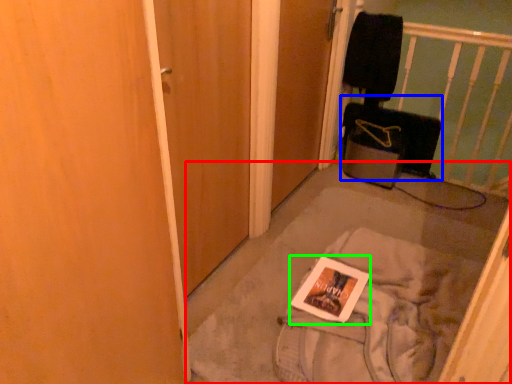
Question: Considering the real-world distances, which object is farthest from concrete (highlighted by a red box)? luggage (highlighted by a blue box) or magazine (highlighted by a green box)?

Choices:
 (A) luggage
 (B) magazine

Answer: (A)